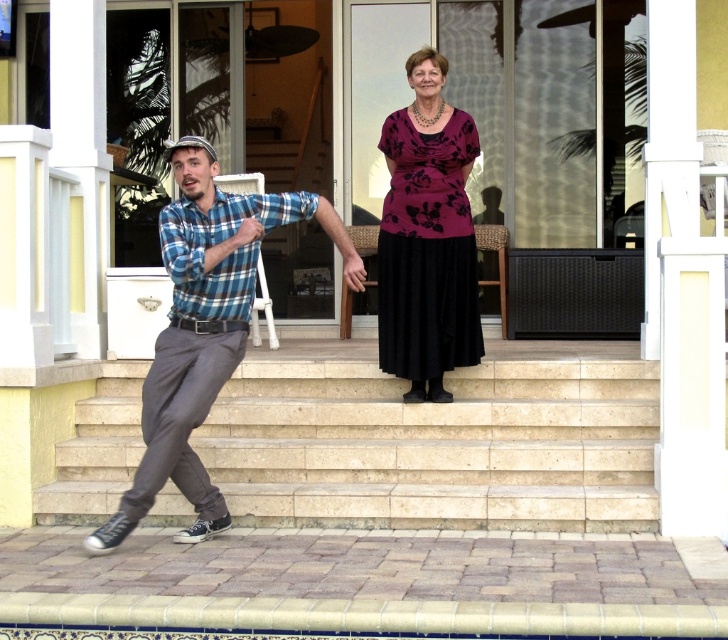
Is beige stone stairs at center below blue plaid shirt at left?

Yes.

Does beige stone stairs at center come in front of blue plaid shirt at left?

No, it is behind blue plaid shirt at left.

The width and height of the screenshot is (728, 640). Find the location of `beige stone stairs at center`. beige stone stairs at center is located at coordinates (438, 445).

Can you confirm if beige stone stairs at center is positioned below blue plaid shirt at lower left?

Yes, beige stone stairs at center is below blue plaid shirt at lower left.

Is beige stone stairs at center bigger than blue plaid shirt at lower left?

Indeed, beige stone stairs at center has a larger size compared to blue plaid shirt at lower left.

Image resolution: width=728 pixels, height=640 pixels. What are the coordinates of `beige stone stairs at center` in the screenshot? It's located at (438, 445).

Looking at this image, can you confirm if beige stone stairs at center is positioned to the left of purple floral fabric dress at center?

Correct, you'll find beige stone stairs at center to the left of purple floral fabric dress at center.

Is beige stone stairs at center to the right of purple floral fabric dress at center from the viewer's perspective?

In fact, beige stone stairs at center is to the left of purple floral fabric dress at center.

Which is in front, point (261, 420) or point (414, 129)?

Point (414, 129)

Where is `beige stone stairs at center`? beige stone stairs at center is located at coordinates point(438,445).